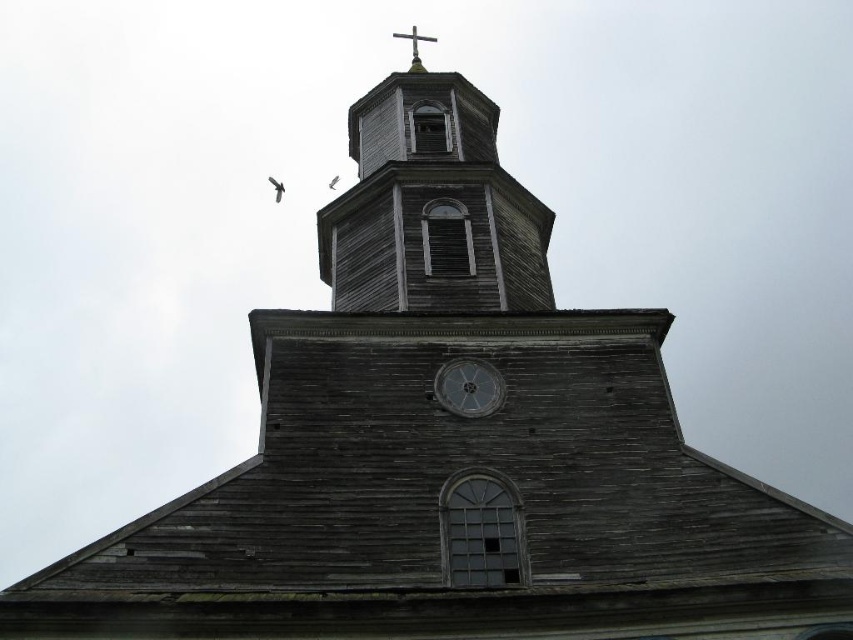
Does metallic gray clock at center have a greater width compared to metallic cross at top?

No, metallic gray clock at center is not wider than metallic cross at top.

Who is lower down, metallic gray clock at center or metallic cross at top?

metallic gray clock at center

Find the location of a particular element. Image resolution: width=853 pixels, height=640 pixels. metallic gray clock at center is located at coordinates pos(468,387).

Who is more distant from viewer, [480,301] or [415,51]?

Positioned behind is point [415,51].

Is weathered wood clock tower at upper center shorter than metallic cross at top?

Indeed, weathered wood clock tower at upper center has a lesser height compared to metallic cross at top.

Where is `weathered wood clock tower at upper center`? weathered wood clock tower at upper center is located at coordinates (431, 208).

Where is `weathered wood clock tower at upper center`? This screenshot has height=640, width=853. weathered wood clock tower at upper center is located at coordinates (431, 208).

Can you confirm if weathered wood clock tower at upper center is positioned below metallic gray clock at center?

Incorrect, weathered wood clock tower at upper center is not positioned below metallic gray clock at center.

Which is in front, point (428, 90) or point (480, 387)?

Point (480, 387) is more forward.

Describe the element at coordinates (431, 208) in the screenshot. I see `weathered wood clock tower at upper center` at that location.

Locate an element on the screen. Image resolution: width=853 pixels, height=640 pixels. weathered wood clock tower at upper center is located at coordinates (431, 208).